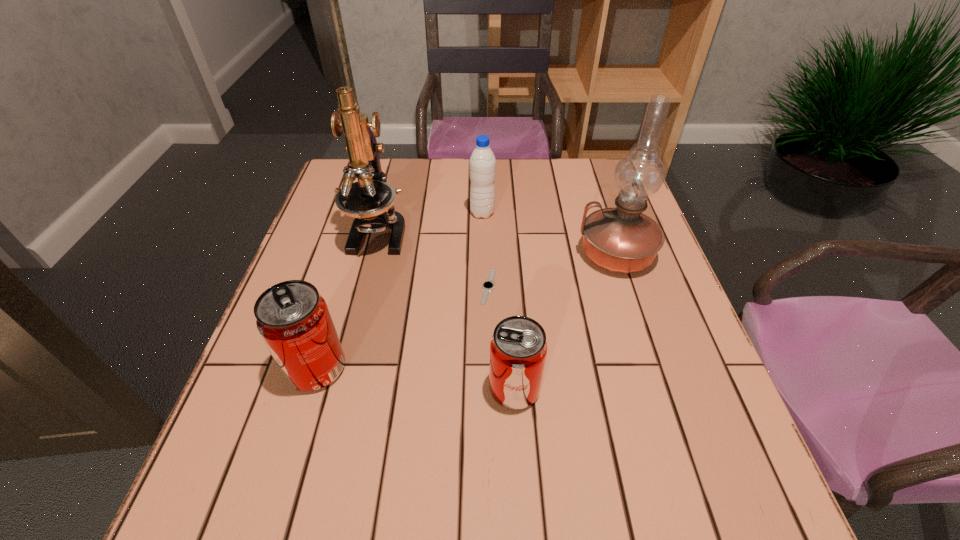
In the current image, all pop sodas are evenly spaced. To maintain this equal spacing, where should an additional pop soda be placed on the right? Please point out a free spot. Please provide its 2D coordinates. Your answer should be formatted as a tuple, i.e. [(x, y)], where the tuple contains the x and y coordinates of a point satisfying the conditions above.

[(729, 411)]